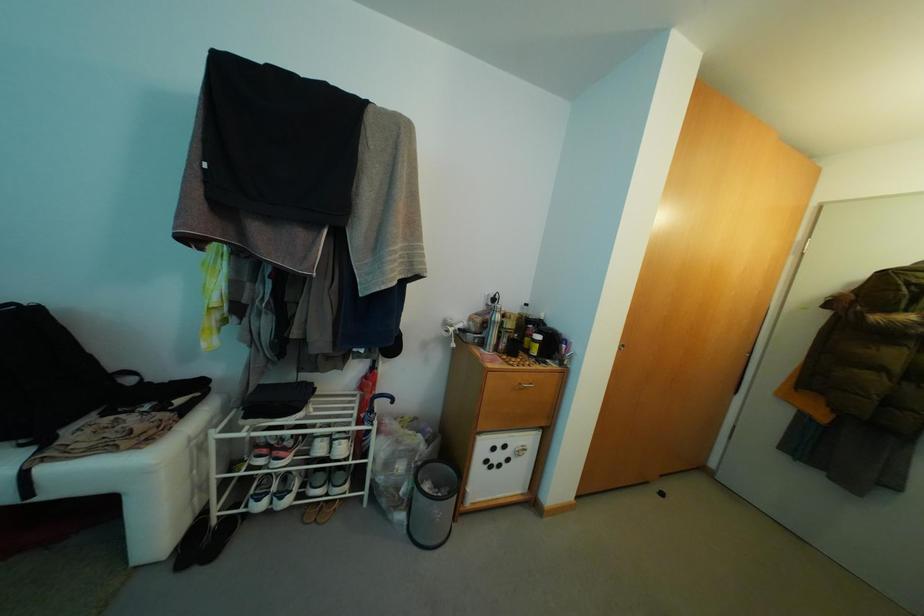
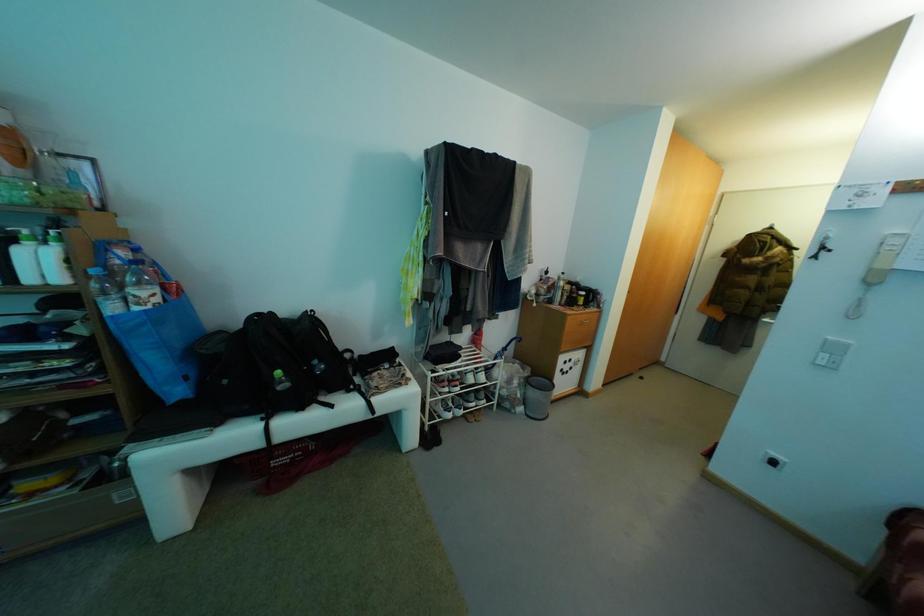
In a continuous first-person perspective shot, in which direction is the camera moving?

The movement direction of the cameraman is left, backward.